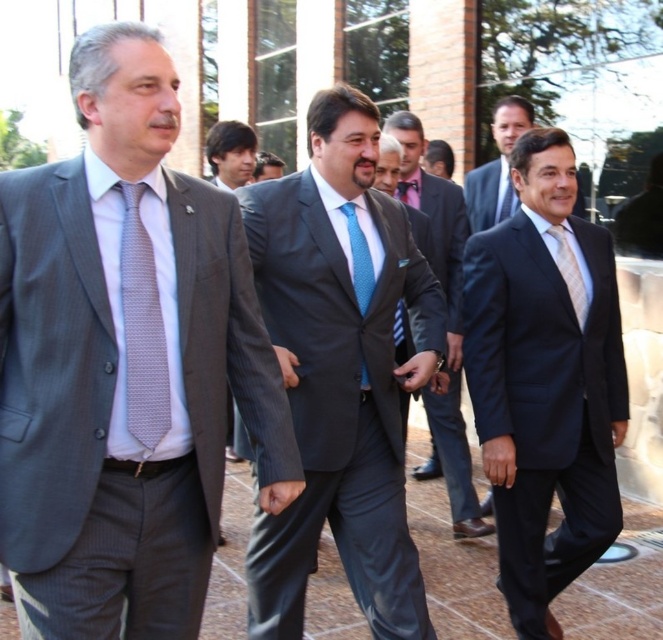
You are a photographer at a corporate event and need to adjust your camera settings to focus on both the blue dotted tie at center and the blue textured suit at center. Which object should you prioritize focusing on first if you want to ensure the larger object is in sharp focus?

The blue textured suit at center is larger than the blue dotted tie at center, so you should prioritize focusing on the blue textured suit at center first to ensure it is in sharp focus.

You are a photographer trying to capture a group photo of the men in the image. You need to ensure that both the blue silk suit at center and the blue textured suit at center are clearly visible in the frame. Based on their height, which suit will appear larger in the photo?

The blue silk suit at center will appear larger in the photo because it is taller than the blue textured suit at center.